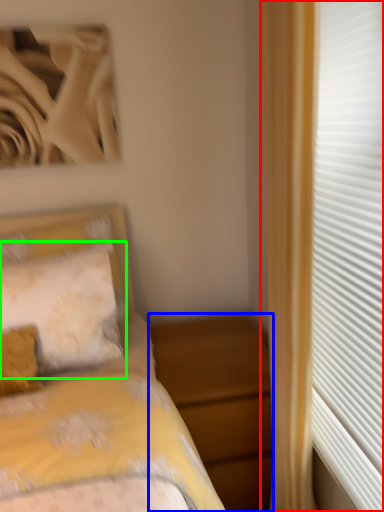
Question: Which is nearer to the curtain (highlighted by a red box)? nightstand (highlighted by a blue box) or pillow (highlighted by a green box).

Choices:
 (A) nightstand
 (B) pillow

Answer: (A)